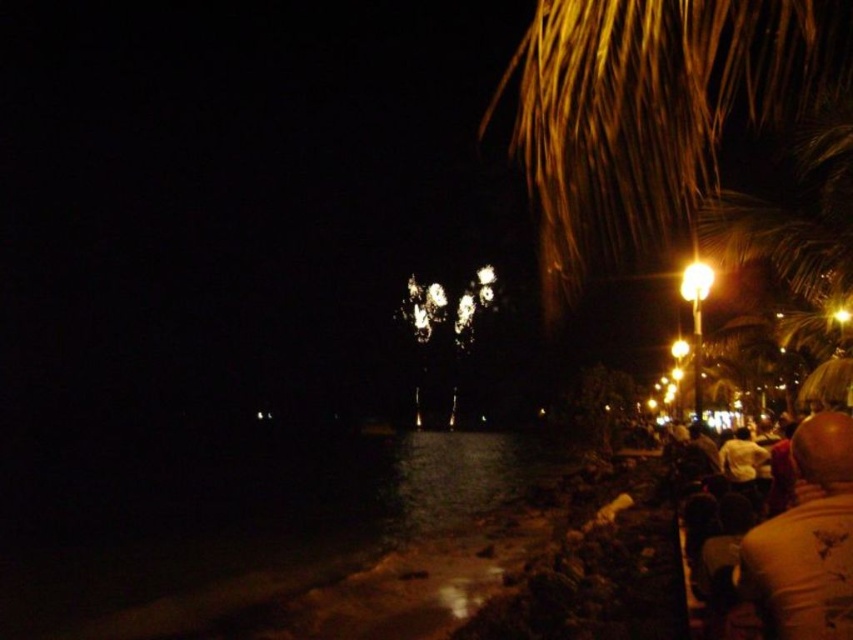
You are standing at the waterfront and see the brown textured palm tree at upper right and the white cotton shirt at lower right. Which object is closer to you?

The brown textured palm tree at upper right is closer to you since it is in front of the white cotton shirt at lower right.